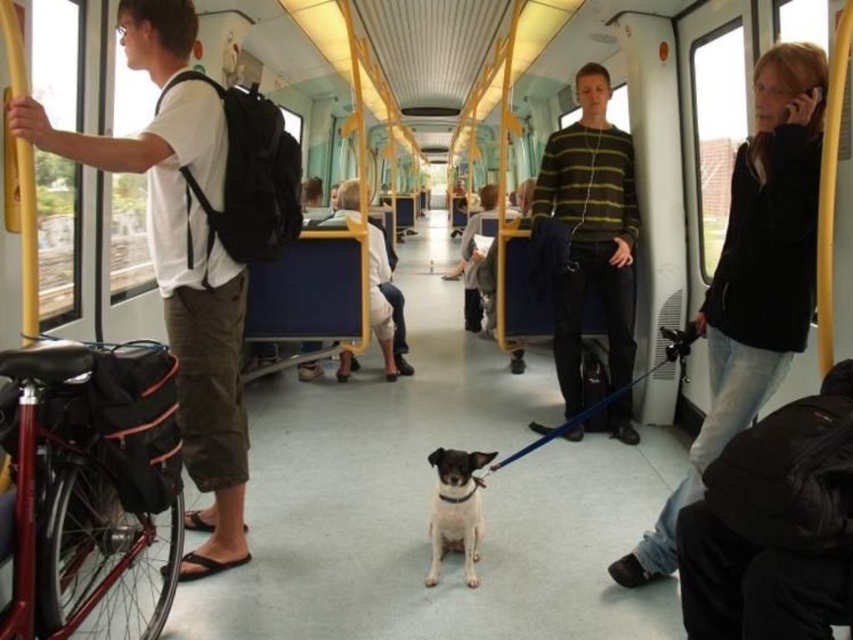
Can you confirm if black leather jacket at upper right is bigger than white smooth dog at center?

Indeed, black leather jacket at upper right has a larger size compared to white smooth dog at center.

Can you confirm if black leather jacket at upper right is thinner than white smooth dog at center?

In fact, black leather jacket at upper right might be wider than white smooth dog at center.

Identify the location of black leather jacket at upper right. This screenshot has width=853, height=640. (753, 278).

Which of these two, white t-shirt at left or white smooth dog at center, stands shorter?

white smooth dog at center

This screenshot has width=853, height=640. Describe the element at coordinates (183, 289) in the screenshot. I see `white t-shirt at left` at that location.

Between point (62, 152) and point (468, 566), which one is positioned behind?

Positioned behind is point (468, 566).

The image size is (853, 640). In order to click on white t-shirt at left in this screenshot , I will do `click(183, 289)`.

Is striped sweater at center smaller than white smooth dog at center?

No.

Does point (631, 426) come in front of point (471, 477)?

No, (631, 426) is behind (471, 477).

Does point (566, 282) come behind point (440, 556)?

Yes, point (566, 282) is behind point (440, 556).

Where is `striped sweater at center`? striped sweater at center is located at coordinates (590, 230).